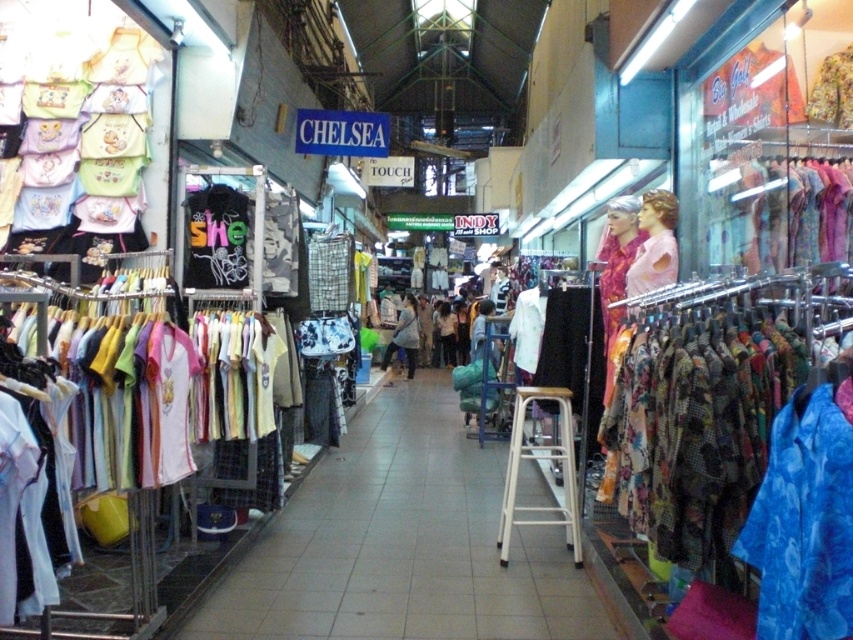
You are a customer in the store and want to try on the matte pink dress at center. The white metal stool at center is available. Can you sit on the stool while trying on the dress?

The white metal stool at center is not as tall as matte pink dress at center, so it may be difficult to sit comfortably while trying on the dress since the stool is shorter than the dress.

You are a customer in the market and want to locate the printed fabric dress at right. According to the coordinates provided, where should you look to find it?

The printed fabric dress at right is located at coordinates point (780,212).

You are a customer in the store and want to buy a dress. You see the light blue fabric dress at center and the matte pink dress at center. Which one is more to the left?

The light blue fabric dress at center is more to the left than the matte pink dress at center.